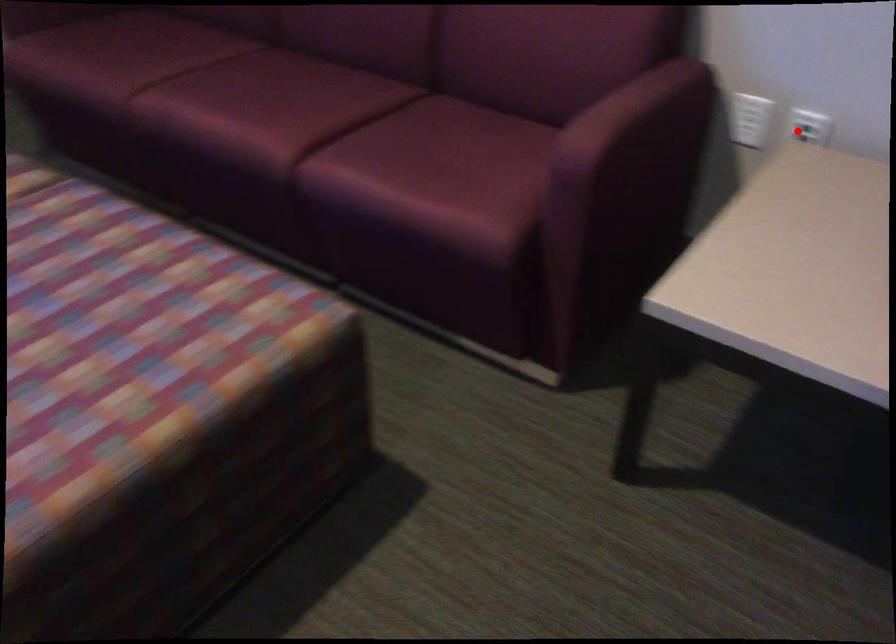
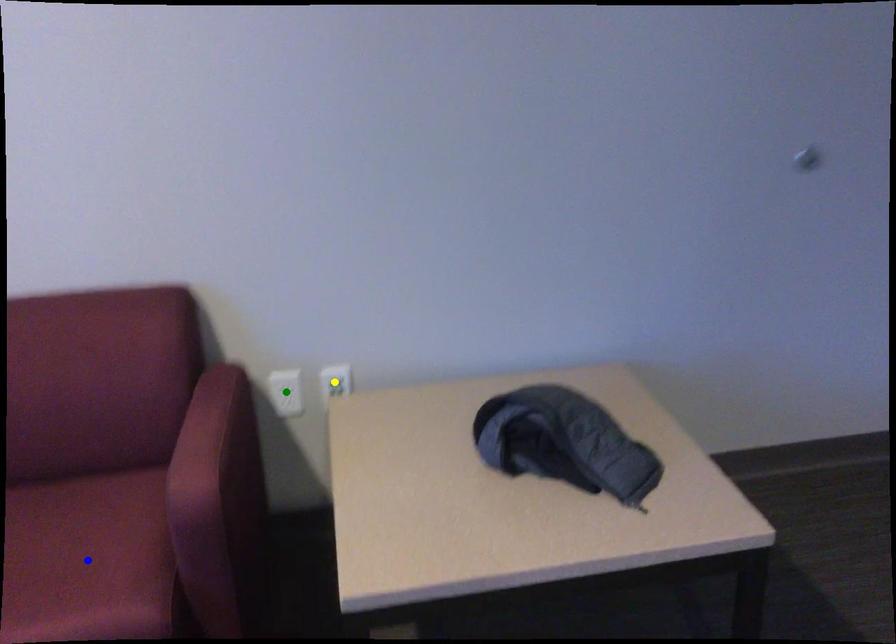
Question: I am providing you with two images of the same scene from different viewpoints. A red point is marked on the first image. You are given multiple points on the second image. In image 2, which mark is for the same physical point as the one in image 1?

Choices:
 (A) blue point
 (B) yellow point
 (C) green point

Answer: (B)